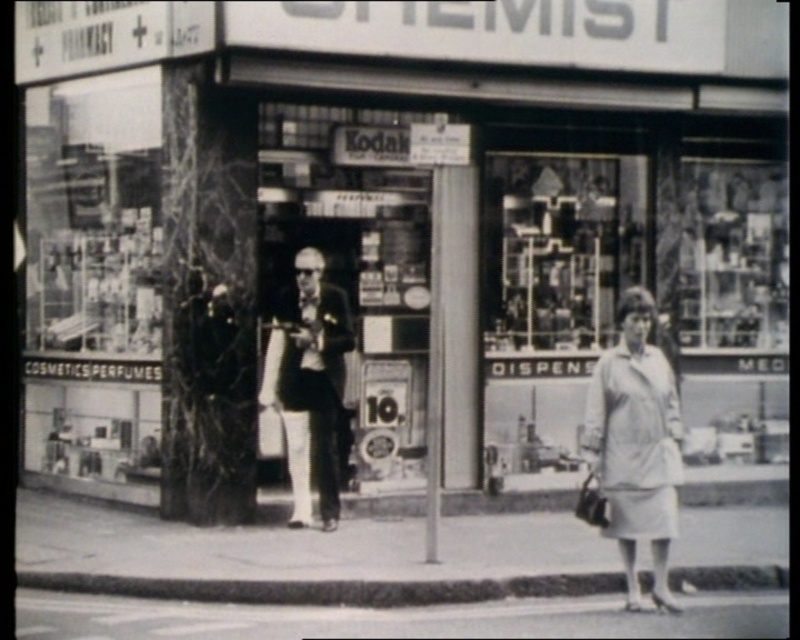
Does point (524, 179) lie in front of point (678, 436)?

No, (524, 179) is further to viewer.

Does metallic glass shelves at center have a smaller size compared to light gray fabric coat at center?

No, metallic glass shelves at center is not smaller than light gray fabric coat at center.

Which is in front, point (620, 246) or point (642, 330)?

Point (642, 330)

Where is `metallic glass shelves at center`? The height and width of the screenshot is (640, 800). metallic glass shelves at center is located at coordinates pos(560,248).

Can you confirm if light gray fabric coat at center is wider than smooth black suit at center?

Incorrect, light gray fabric coat at center's width does not surpass smooth black suit at center's.

In the scene shown: Is light gray fabric coat at center bigger than smooth black suit at center?

No, light gray fabric coat at center is not bigger than smooth black suit at center.

Is point (662, 403) positioned behind point (282, 360)?

No.

This screenshot has width=800, height=640. What are the coordinates of `light gray fabric coat at center` in the screenshot? It's located at (636, 445).

Is metallic glass shelves at center further to the viewer compared to smooth black suit at center?

Yes, metallic glass shelves at center is further from the viewer.

Is point (572, 192) farther from camera compared to point (341, 356)?

That is True.

Image resolution: width=800 pixels, height=640 pixels. What do you see at coordinates (560, 248) in the screenshot?
I see `metallic glass shelves at center` at bounding box center [560, 248].

Locate an element on the screen. Image resolution: width=800 pixels, height=640 pixels. metallic glass shelves at center is located at coordinates (560, 248).